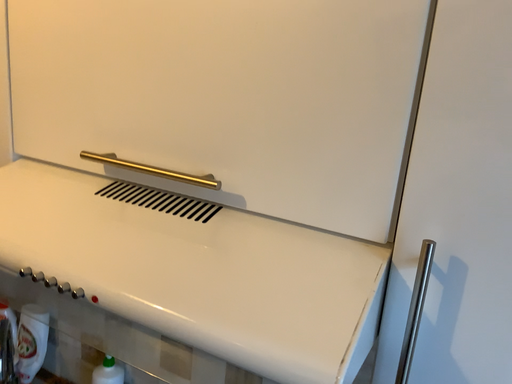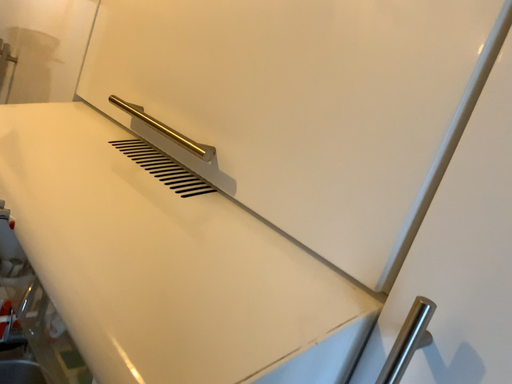
Question: How did the camera likely rotate when shooting the video?

Choices:
 (A) rotated left
 (B) rotated right

Answer: (A)